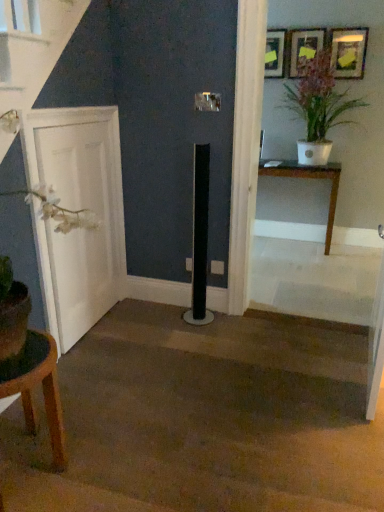
Find the location of `empty space that is in between brown wooden table at lower left, the 1th table positioned from the bottom, and white matte door at left`. empty space that is in between brown wooden table at lower left, the 1th table positioned from the bottom, and white matte door at left is located at coordinates (79, 379).